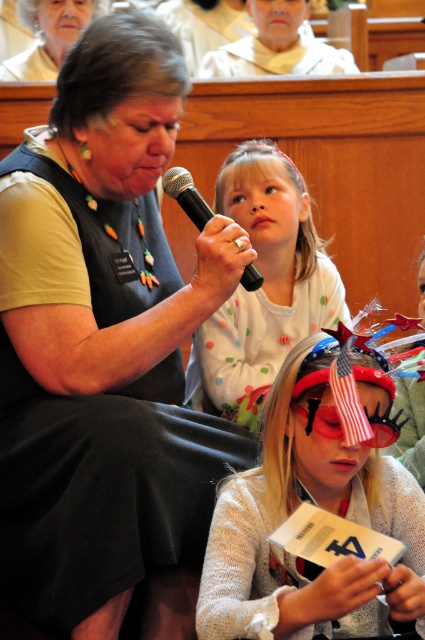
You are a photographer standing in the courtroom and want to take a photo that includes both the matte black vest at upper left and the polka dot shirt at upper center. What is the minimum distance you need to move backward to ensure both objects are in frame?

The minimum distance to move backward is determined by the camera lens and sensor size, which are not provided. However, since the two objects are 23.23 inches apart, you can adjust your position to ensure both are within the camera frame by moving back until both the matte black vest at upper left and the polka dot shirt at upper center are visible.

You are an interior designer assessing the layout of this courtroom scene. You notice the white fabric at upper center and the black plastic microphone at upper center. Which object is positioned higher in the image?

The white fabric at upper center is much taller than the black plastic microphone at upper center, so it is positioned higher in the image.